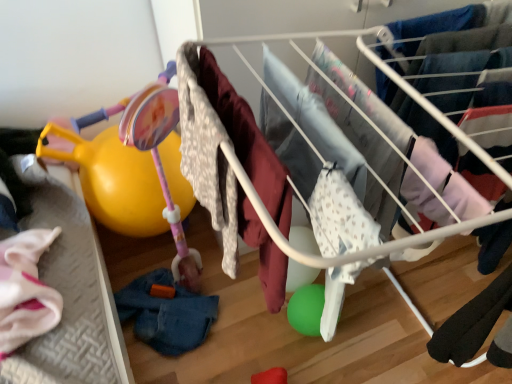
I want to click on free space to the back side of denim at lower left, which is the 2th clothing in top-to-bottom order, so click(169, 244).